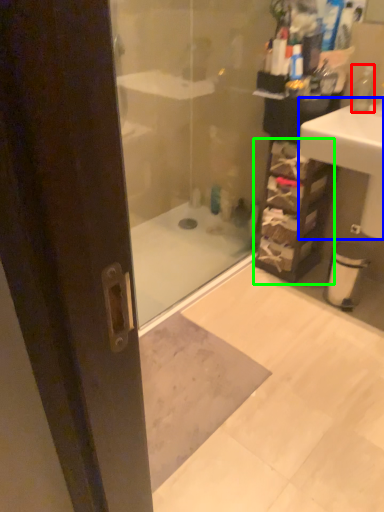
Question: Which object is positioned closest to soap dispenser (highlighted by a red box)? Select from sink (highlighted by a blue box) and shelf (highlighted by a green box).

Choices:
 (A) sink
 (B) shelf

Answer: (A)